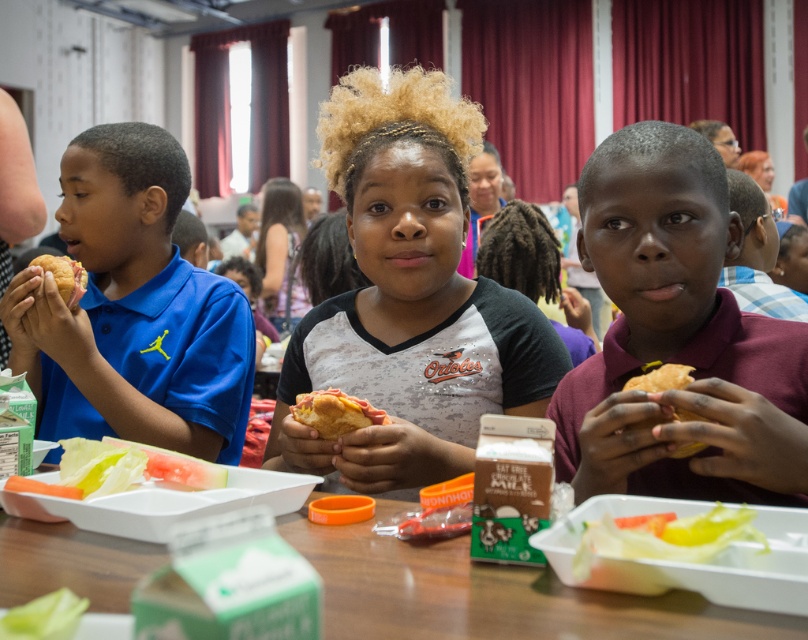
Does translucent plastic lettuce at lower center appear on the right side of matte yellow bun at left?

Yes, translucent plastic lettuce at lower center is to the right of matte yellow bun at left.

Can you confirm if translucent plastic lettuce at lower center is taller than matte yellow bun at left?

Incorrect, translucent plastic lettuce at lower center's height is not larger of matte yellow bun at left's.

Who is more forward, (668, 547) or (81, 268)?

Point (668, 547) is more forward.

Identify the location of translucent plastic lettuce at lower center. (665, 536).

Does green cardboard milk carton at lower center have a greater height compared to translucent plastic lettuce at lower center?

No.

Is green cardboard milk carton at lower center bigger than translucent plastic lettuce at lower center?

Yes, green cardboard milk carton at lower center is bigger than translucent plastic lettuce at lower center.

Which is in front, point (423, 611) or point (602, 516)?

Point (423, 611)

Locate an element on the screen. green cardboard milk carton at lower center is located at coordinates (489, 593).

Between green cardboard milk carton at lower center and matte yellow bun at left, which one is positioned lower?

green cardboard milk carton at lower center is below.

Is green cardboard milk carton at lower center shorter than matte yellow bun at left?

Indeed, green cardboard milk carton at lower center has a lesser height compared to matte yellow bun at left.

Does point (430, 593) lie in front of point (76, 269)?

Yes, it is in front of point (76, 269).

The height and width of the screenshot is (640, 808). I want to click on green cardboard milk carton at lower center, so click(489, 593).